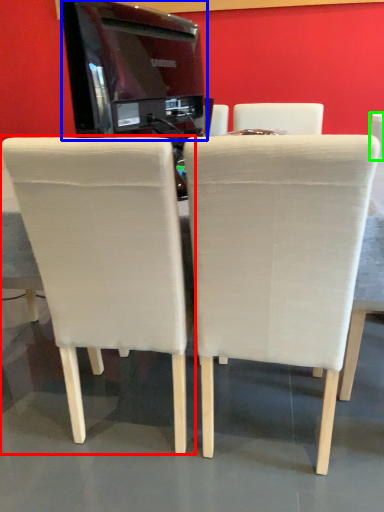
Question: Estimate the real-world distances between objects in this image. Which object is farther from chair (highlighted by a red box), appliance (highlighted by a blue box) or chair (highlighted by a green box)?

Choices:
 (A) appliance
 (B) chair

Answer: (B)